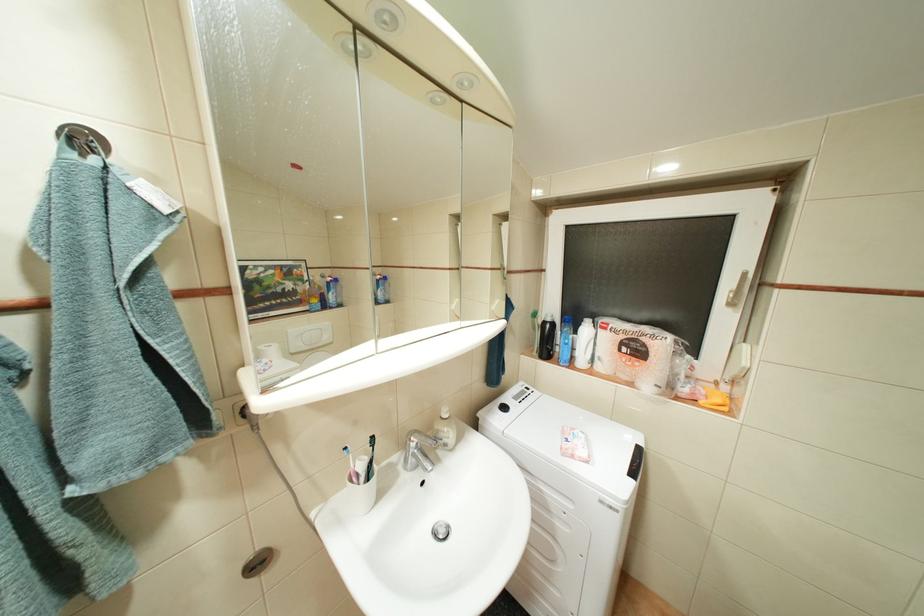
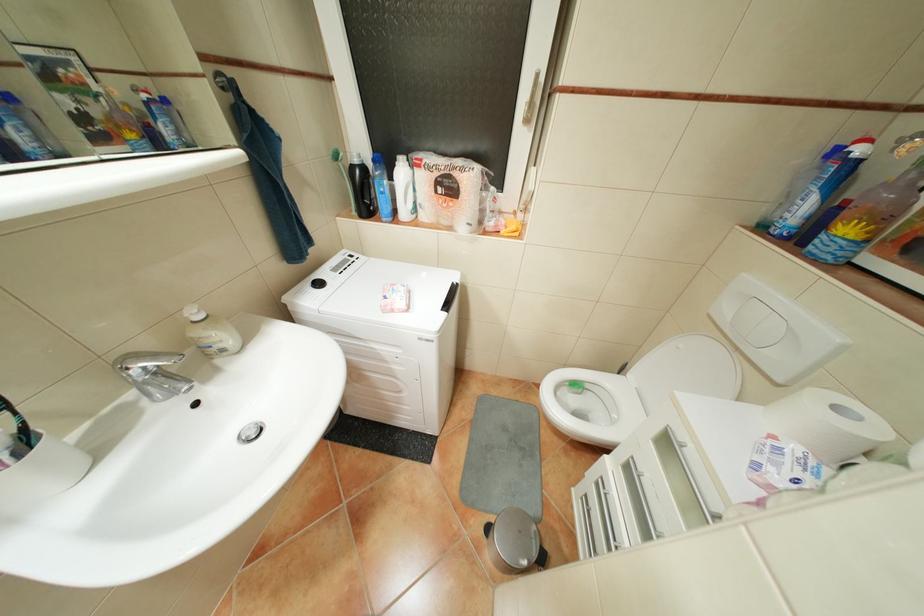
First-person continuous shooting, in which direction is the camera rotating?

The camera rotated toward right-down.